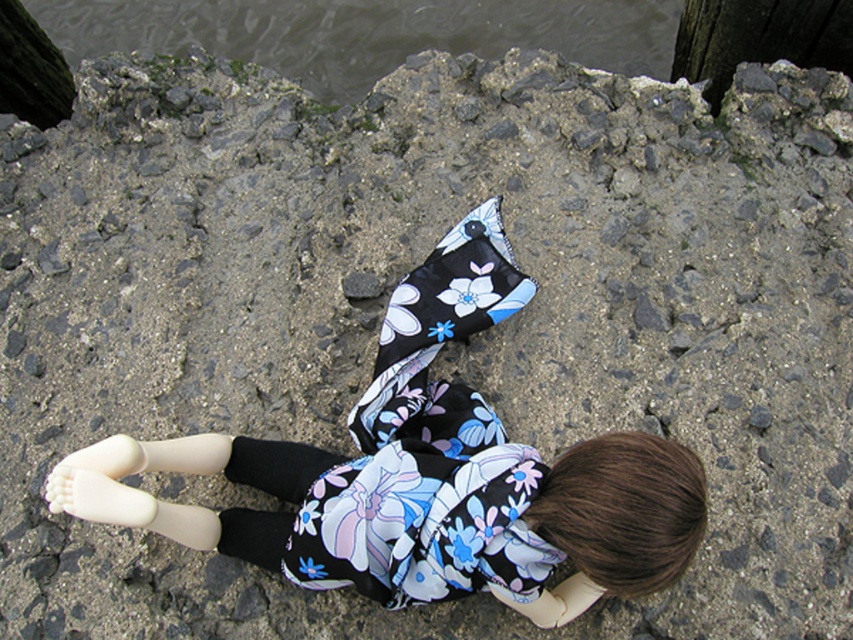
You are a photographer trying to capture the doll and the water in the scene. Since the floral fabric doll at center is much taller than the clear water at upper center, which object should you focus on first to ensure proper framing?

The floral fabric doll at center is much taller than the clear water at upper center, so you should focus on the floral fabric doll at center first to ensure proper framing.

You are a photographer trying to capture the doll on the rocky surface. You notice two points marked in the image. Which point, point (363, 460) or point (57, 22), is closer to your camera lens?

Point (363, 460) is closer to the camera than point (57, 22).